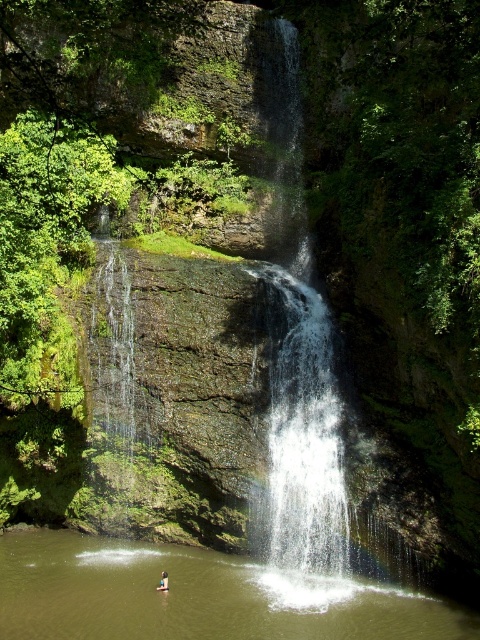
Can you confirm if clear water at center is thinner than light brown wooden stick at lower center?

No, clear water at center is not thinner than light brown wooden stick at lower center.

Can you confirm if clear water at center is smaller than light brown wooden stick at lower center?

No.

Identify the location of clear water at center. The image size is (480, 640). (303, 433).

Measure the distance between brown liquid water at center and clear water at center.

brown liquid water at center is 3.62 meters away from clear water at center.

Can you confirm if brown liquid water at center is smaller than clear water at center?

Correct, brown liquid water at center occupies less space than clear water at center.

I want to click on brown liquid water at center, so click(196, 596).

Does brown liquid water at center appear over light brown wooden stick at lower center?

No, brown liquid water at center is not above light brown wooden stick at lower center.

Where is `brown liquid water at center`? Image resolution: width=480 pixels, height=640 pixels. brown liquid water at center is located at coordinates (196, 596).

What do you see at coordinates (196, 596) in the screenshot? The height and width of the screenshot is (640, 480). I see `brown liquid water at center` at bounding box center [196, 596].

The width and height of the screenshot is (480, 640). Identify the location of brown liquid water at center. (196, 596).